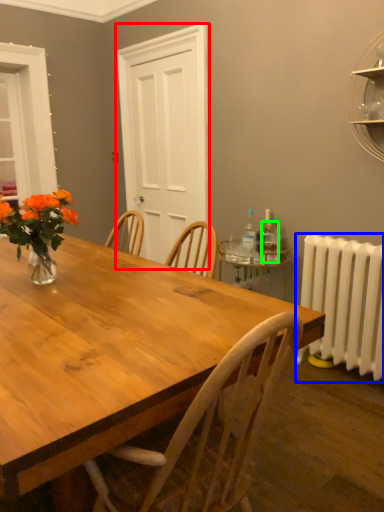
Question: Based on their relative distances, which object is farther from glass door (highlighted by a red box)? Choose from radiator (highlighted by a blue box) and bottle (highlighted by a green box).

Choices:
 (A) radiator
 (B) bottle

Answer: (A)